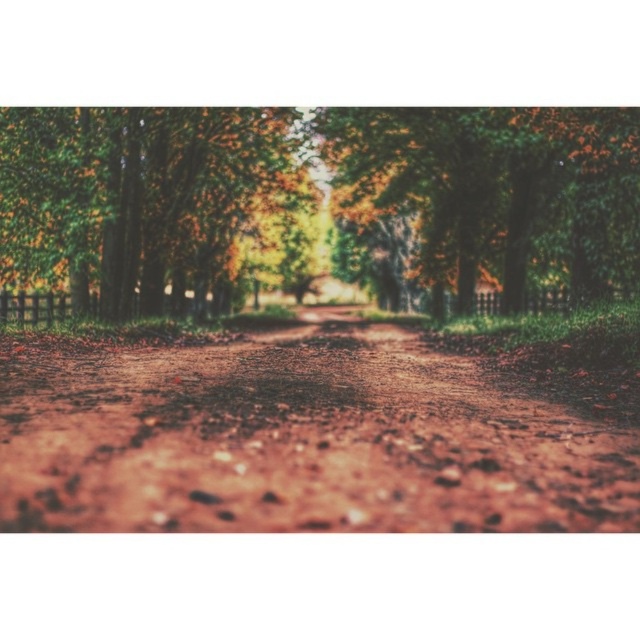
This screenshot has height=640, width=640. Describe the element at coordinates (300, 440) in the screenshot. I see `brown gravel dirt track at center` at that location.

Which of these two, brown gravel dirt track at center or green leafy tree at center, stands shorter?

Standing shorter between the two is brown gravel dirt track at center.

Between point (548, 448) and point (624, 141), which one is positioned in front?

Point (548, 448) is in front.

Locate an element on the screen. The height and width of the screenshot is (640, 640). brown gravel dirt track at center is located at coordinates (300, 440).

Does point (369, 280) come in front of point (147, 260)?

No.

Does green leafy forest at center have a lesser height compared to green leafy tree at upper left?

Yes, green leafy forest at center is shorter than green leafy tree at upper left.

This screenshot has height=640, width=640. In order to click on green leafy forest at center in this screenshot , I will do `click(314, 198)`.

Is green leafy tree at upper left above green leafy tree at center?

Actually, green leafy tree at upper left is below green leafy tree at center.

Who is positioned more to the right, green leafy tree at upper left or green leafy tree at center?

green leafy tree at center is more to the right.

This screenshot has width=640, height=640. Describe the element at coordinates (141, 198) in the screenshot. I see `green leafy tree at upper left` at that location.

Image resolution: width=640 pixels, height=640 pixels. I want to click on green leafy tree at upper left, so click(141, 198).